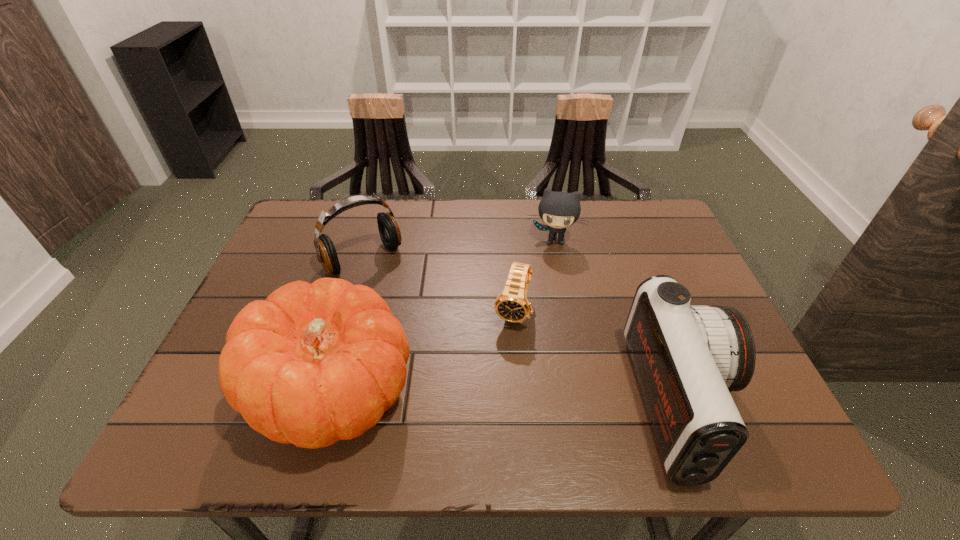
The image size is (960, 540). What are the coordinates of `pumpkin present at the near edge` in the screenshot? It's located at (313, 364).

At what (x,y) coordinates should I click in order to perform the action: click on camcorder present at the near edge. Please return your answer as a coordinate pair (x, y). The height and width of the screenshot is (540, 960). Looking at the image, I should click on (688, 358).

You are a GUI agent. You are given a task and a screenshot of the screen. Output one action in this format:
    pyautogui.click(x=<x>, y=<y>)
    Task: Click on the pumpkin that is at the left edge
    
    Given the screenshot: What is the action you would take?
    pyautogui.click(x=313, y=364)

This screenshot has width=960, height=540. Find the location of `headset positioned at the left edge`. headset positioned at the left edge is located at coordinates 389,231.

I want to click on object that is at the right edge, so click(x=688, y=358).

Locate an element on the screen. This screenshot has height=540, width=960. object at the far left corner is located at coordinates (389, 231).

At what (x,y) coordinates should I click in order to perform the action: click on object positioned at the near left corner. Please return your answer as a coordinate pair (x, y). This screenshot has height=540, width=960. Looking at the image, I should click on (313, 364).

Find the location of a particular element. The image size is (960, 540). object that is positioned at the near right corner is located at coordinates (688, 358).

The height and width of the screenshot is (540, 960). What are the coordinates of `vacant region at the far edge` in the screenshot? It's located at (612, 229).

Image resolution: width=960 pixels, height=540 pixels. In the image, there is a desktop. In order to click on blank space at the near edge in this screenshot , I will do `click(615, 400)`.